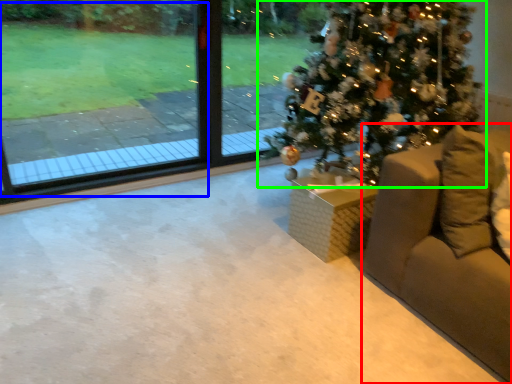
Question: Which object is positioned farthest from furniture (highlighted by a red box)? Select from window screen (highlighted by a blue box) and christmas tree (highlighted by a green box).

Choices:
 (A) window screen
 (B) christmas tree

Answer: (A)